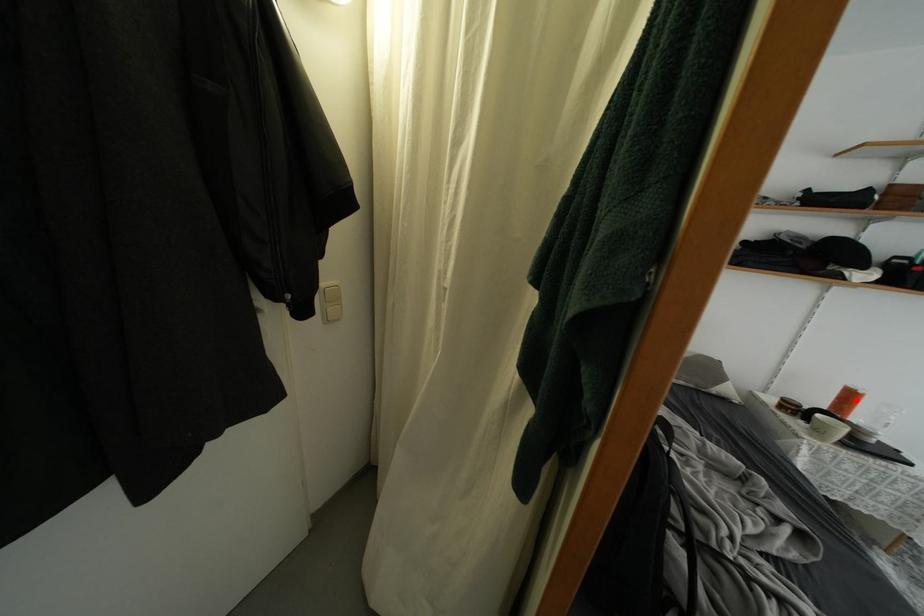
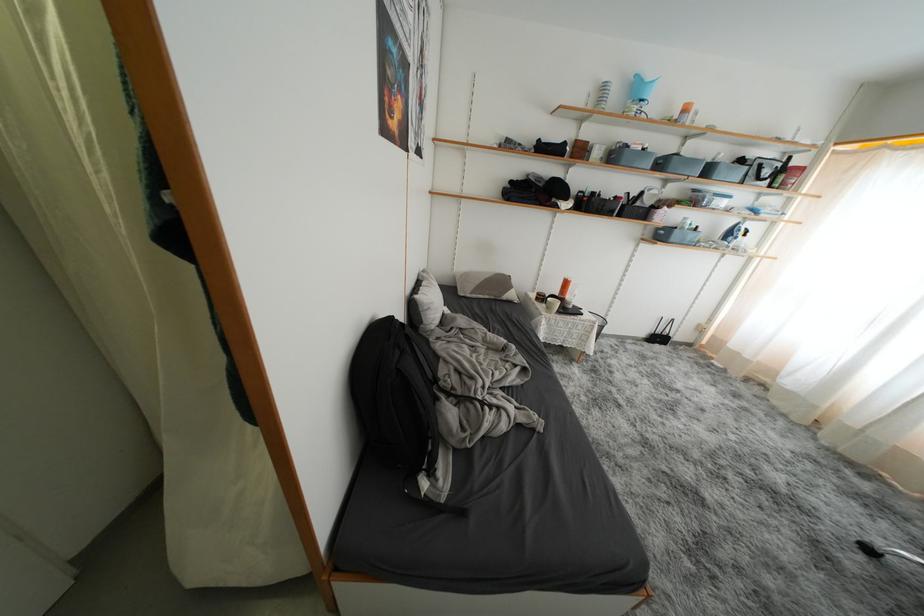
The point at the highlighted location is marked in the first image. Where is the corresponding point in the second image?

(572, 286)